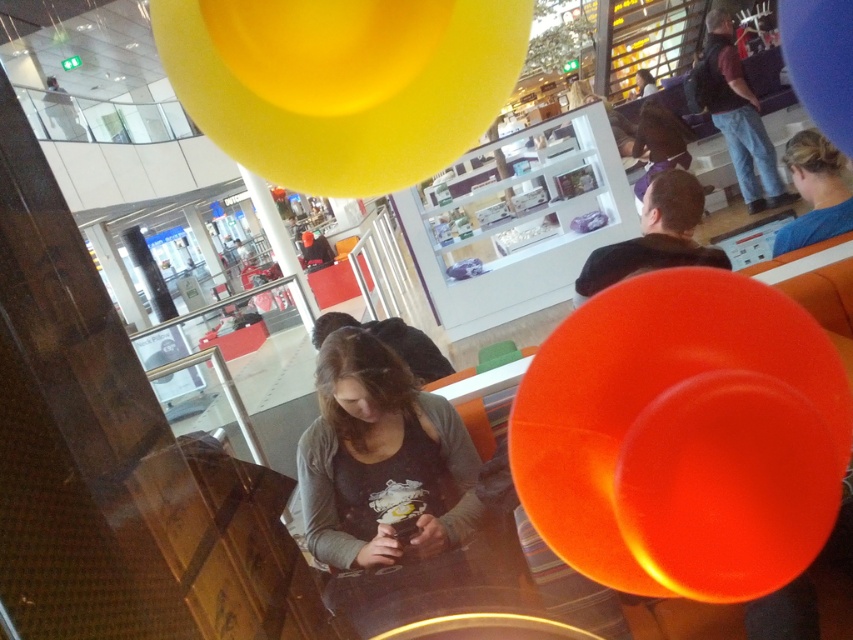
Does matte gray shirt at center have a lesser width compared to blue rubber balloon at upper right?

Yes.

Does point (376, 364) lie in front of point (791, 49)?

Yes, point (376, 364) is in front of point (791, 49).

Does point (368, 429) lie in front of point (840, 60)?

Yes.

This screenshot has width=853, height=640. I want to click on matte gray shirt at center, so click(384, 477).

Who is positioned more to the left, orange glossy balloon at lower right or matte black shirt at upper right?

orange glossy balloon at lower right

Who is more forward, (769,292) or (641,186)?

Point (769,292) is in front.

Where is `orange glossy balloon at lower right`? orange glossy balloon at lower right is located at coordinates (683, 436).

Between orange glossy balloon at lower right and yellow matte balloon at upper center, which one is positioned higher?

yellow matte balloon at upper center is above.

Between orange glossy balloon at lower right and yellow matte balloon at upper center, which one has less height?

orange glossy balloon at lower right

You are a GUI agent. You are given a task and a screenshot of the screen. Output one action in this format:
    pyautogui.click(x=<x>, y=<y>)
    Task: Click on the orange glossy balloon at lower right
    
    Given the screenshot: What is the action you would take?
    pyautogui.click(x=683, y=436)

Locate an element on the screen. The width and height of the screenshot is (853, 640). orange glossy balloon at lower right is located at coordinates (683, 436).